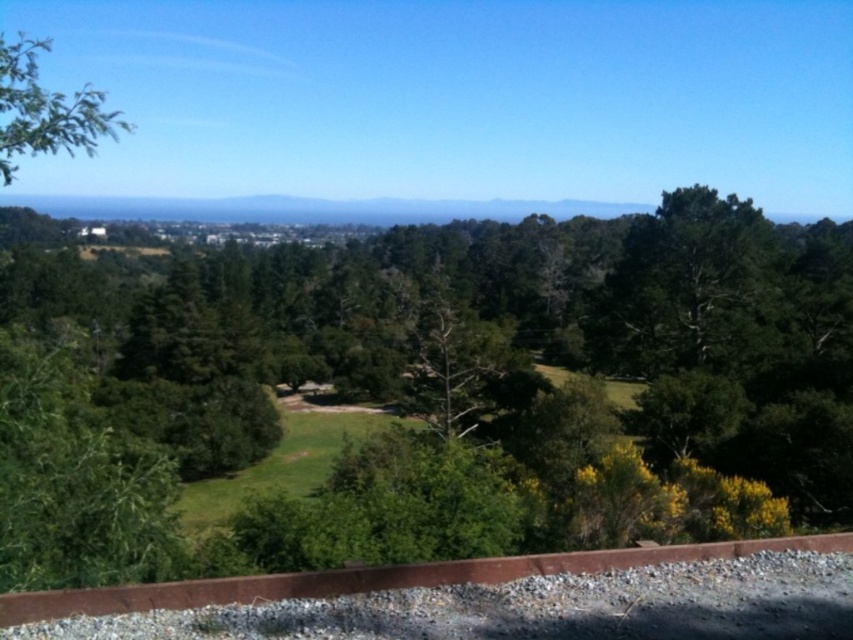
Question: Is green leafy tree at center to the left of green leafy tree at upper left from the viewer's perspective?

Choices:
 (A) yes
 (B) no

Answer: (B)

Question: Among these objects, which one is nearest to the camera?

Choices:
 (A) green leafy tree at center
 (B) green leafy tree at upper left

Answer: (A)

Question: Which point is farther to the camera?

Choices:
 (A) green leafy tree at center
 (B) green leafy tree at upper left

Answer: (B)

Question: Which object is closer to the camera taking this photo?

Choices:
 (A) green leafy tree at center
 (B) green leafy tree at upper left

Answer: (A)

Question: Does green leafy tree at center appear over green leafy tree at upper left?

Choices:
 (A) no
 (B) yes

Answer: (A)

Question: Does green leafy tree at center have a lesser width compared to green leafy tree at upper left?

Choices:
 (A) no
 (B) yes

Answer: (A)